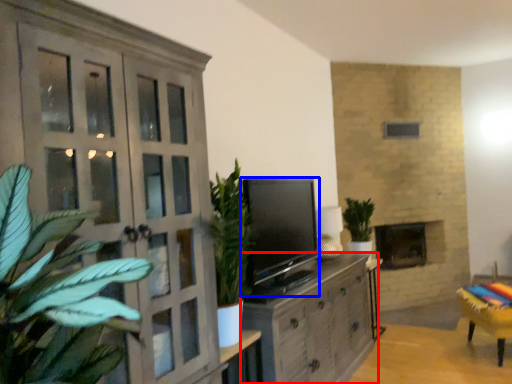
Question: Which object appears closest to the camera in this image, cabinetry (highlighted by a red box) or level (highlighted by a blue box)?

Choices:
 (A) cabinetry
 (B) level

Answer: (A)